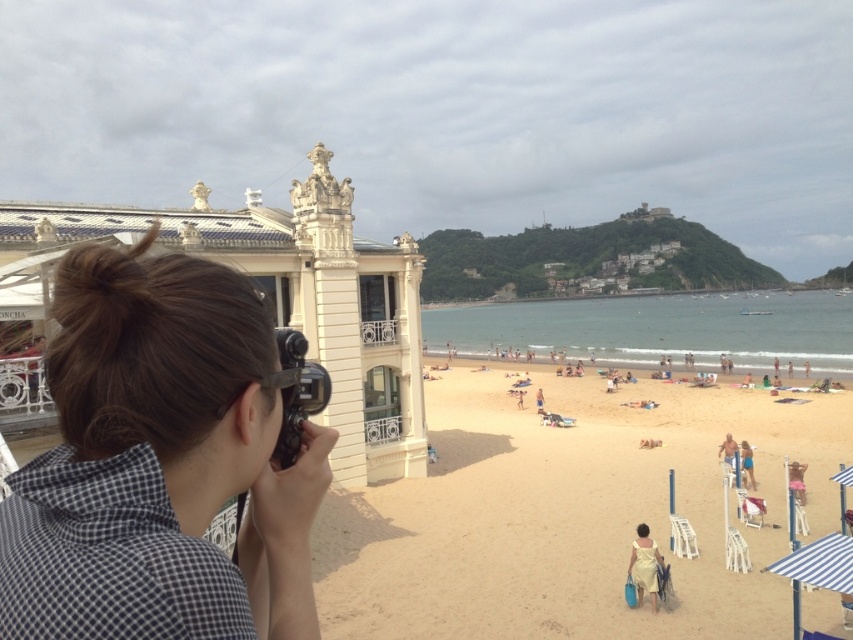
You are standing at the center of the beach scene and want to locate the yellow fabric dress at lower right. According to the coordinates provided, in which direction should you look to find it?

The yellow fabric dress at lower right is located at coordinates point (x=645, y=564), so you should look to your lower right direction to find it.

You are standing at the point labeled point (x=570, y=515). What is the closest object to you in the scene?

The closest object to you at point (x=570, y=515) is the golden sand beach at center.